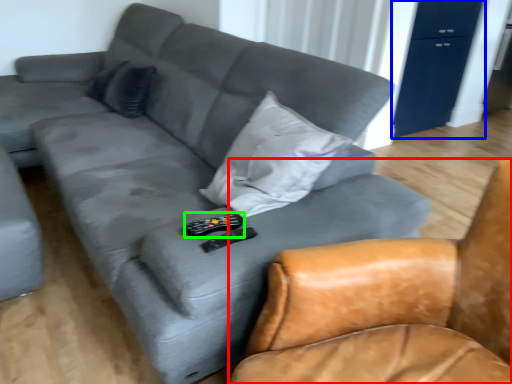
Question: Which object is positioned closest to chair (highlighted by a red box)? Select from dresser (highlighted by a blue box) and remote (highlighted by a green box).

Choices:
 (A) dresser
 (B) remote

Answer: (B)